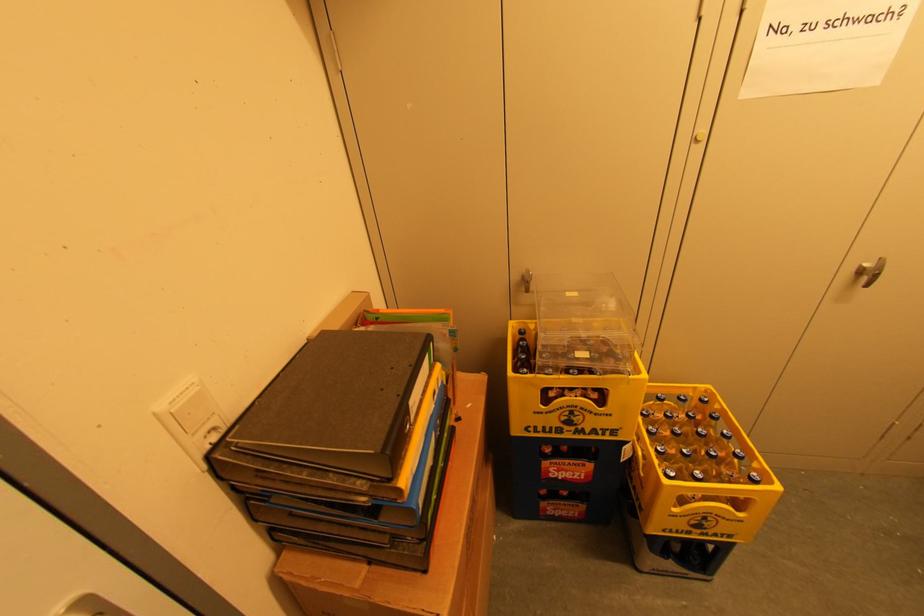
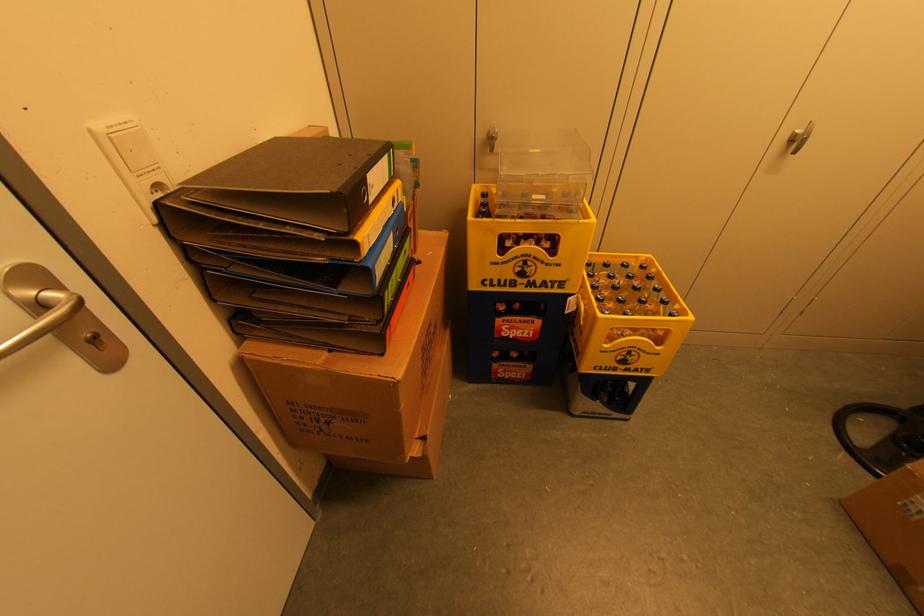
Where in the second image is the point corresponding to [669,573] from the first image?

(598, 413)